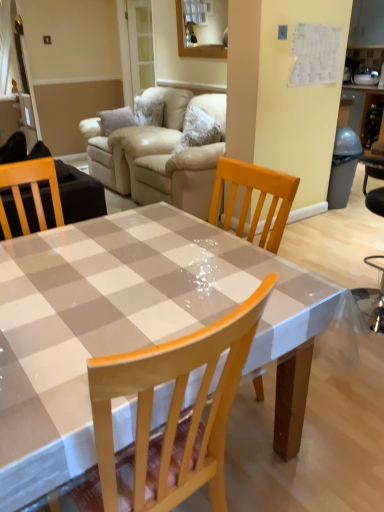
Locate an element on the screen. This screenshot has width=384, height=512. clear plastic table at center is located at coordinates (122, 322).

The width and height of the screenshot is (384, 512). What do you see at coordinates (122, 322) in the screenshot? I see `clear plastic table at center` at bounding box center [122, 322].

What is the approximate width of beige leather couch at upper center?

beige leather couch at upper center is 1.01 meters wide.

Describe the element at coordinates (159, 155) in the screenshot. I see `beige leather couch at upper center` at that location.

Find the location of a particular element. The image size is (384, 512). beige leather couch at upper center is located at coordinates (159, 155).

Locate an element on the screen. This screenshot has height=512, width=384. clear plastic table at center is located at coordinates (122, 322).

Is beige leather couch at upper center at the left side of clear plastic table at center?

Correct, you'll find beige leather couch at upper center to the left of clear plastic table at center.

In the scene shown: In the image, is beige leather couch at upper center positioned in front of or behind clear plastic table at center?

beige leather couch at upper center is positioned farther from the viewer than clear plastic table at center.

Does point (194, 210) appear closer or farther from the camera than point (123, 437)?

Clearly, point (194, 210) is more distant from the camera than point (123, 437).

From the image's perspective, is beige leather couch at upper center over clear plastic table at center?

Yes.

From a real-world perspective, between beige leather couch at upper center and clear plastic table at center, who is vertically lower?

clear plastic table at center.

Considering the sizes of objects beige leather couch at upper center and clear plastic table at center in the image provided, who is wider, beige leather couch at upper center or clear plastic table at center?

Wider between the two is clear plastic table at center.

Is beige leather couch at upper center taller than clear plastic table at center?

Yes.

Based on their sizes in the image, would you say beige leather couch at upper center is bigger or smaller than clear plastic table at center?

Considering their sizes, beige leather couch at upper center takes up more space than clear plastic table at center.

Is clear plastic table at center a part of beige leather couch at upper center?

No, clear plastic table at center is not surrounded by beige leather couch at upper center.

Is beige leather couch at upper center in contact with clear plastic table at center?

No, beige leather couch at upper center is not in contact with clear plastic table at center.

Is beige leather couch at upper center oriented towards clear plastic table at center?

No.

How different are the orientations of beige leather couch at upper center and clear plastic table at center in degrees?

The angle between the facing direction of beige leather couch at upper center and the facing direction of clear plastic table at center is 93.4 degrees.

How distant is beige leather couch at upper center from clear plastic table at center?

6.77 feet.

Where is `kitchen & dining room table that is below the beige leather couch at upper center (from the image's perspective)`? kitchen & dining room table that is below the beige leather couch at upper center (from the image's perspective) is located at coordinates (122, 322).

Based on the photo, does clear plastic table at center appear on the left side of beige leather couch at upper center?

Incorrect, clear plastic table at center is not on the left side of beige leather couch at upper center.

Which is in front, clear plastic table at center or beige leather couch at upper center?

clear plastic table at center is more forward.

Which point is more forward, (153, 248) or (164, 172)?

Point (153, 248)

Consider the image. From the image's perspective, which is below, clear plastic table at center or beige leather couch at upper center?

clear plastic table at center appears lower in the image.

From a real-world perspective, is clear plastic table at center below beige leather couch at upper center?

Yes, from a real-world perspective, clear plastic table at center is below beige leather couch at upper center.

Considering the sizes of objects clear plastic table at center and beige leather couch at upper center in the image provided, who is thinner, clear plastic table at center or beige leather couch at upper center?

With smaller width is beige leather couch at upper center.

Is clear plastic table at center taller or shorter than beige leather couch at upper center?

Considering their sizes, clear plastic table at center has less height than beige leather couch at upper center.

Between clear plastic table at center and beige leather couch at upper center, which one has larger size?

Bigger between the two is beige leather couch at upper center.

Is clear plastic table at center outside of beige leather couch at upper center?

That's correct, clear plastic table at center is outside of beige leather couch at upper center.

Is clear plastic table at center touching beige leather couch at upper center?

No, clear plastic table at center is not touching beige leather couch at upper center.

Is clear plastic table at center looking in the opposite direction of beige leather couch at upper center?

No.

How many degrees apart are the facing directions of clear plastic table at center and beige leather couch at upper center?

They differ by 93.4 degrees in their facing directions.

I want to click on kitchen & dining room table below the beige leather couch at upper center (from the image's perspective), so click(122, 322).

Find the location of `kitchen & dining room table in front of the beige leather couch at upper center`. kitchen & dining room table in front of the beige leather couch at upper center is located at coordinates (122, 322).

Locate an element on the screen. The height and width of the screenshot is (512, 384). studio couch positioned vertically above the clear plastic table at center (from a real-world perspective) is located at coordinates (159, 155).